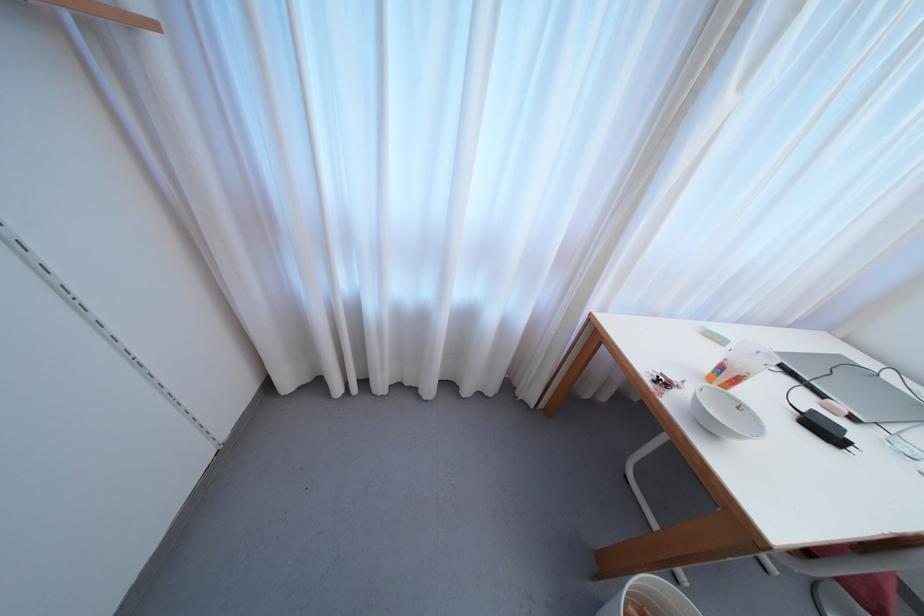
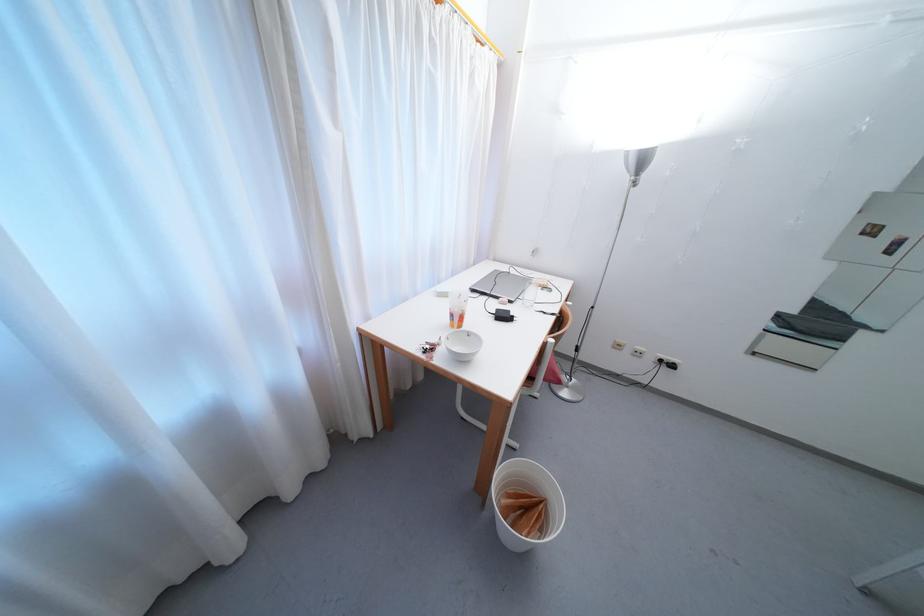
Question: Based on the continuous images, in which direction is the camera rotating? Reply with the corresponding letter.

Choices:
 (A) Left
 (B) Right
 (C) Up
 (D) Down

Answer: (B)